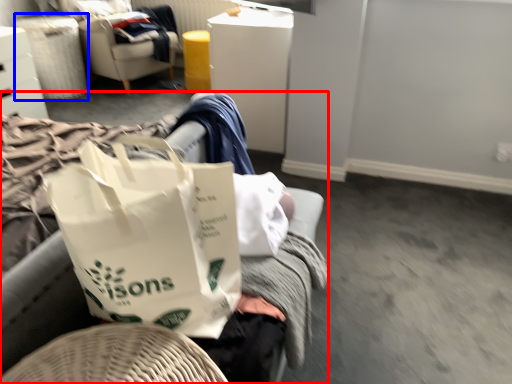
Question: Which of the following is the closest to the observer, furniture (highlighted by a red box) or laundry basket (highlighted by a blue box)?

Choices:
 (A) furniture
 (B) laundry basket

Answer: (A)